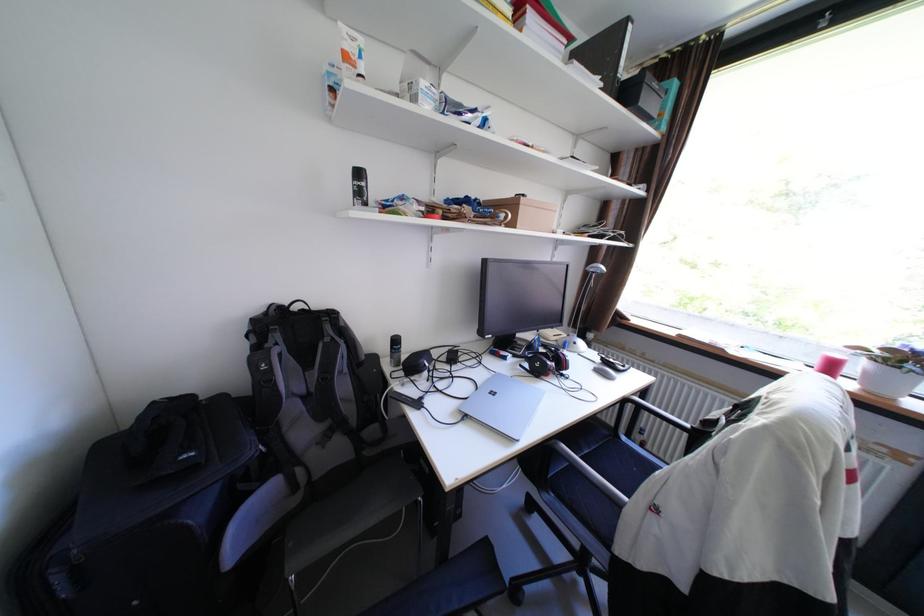
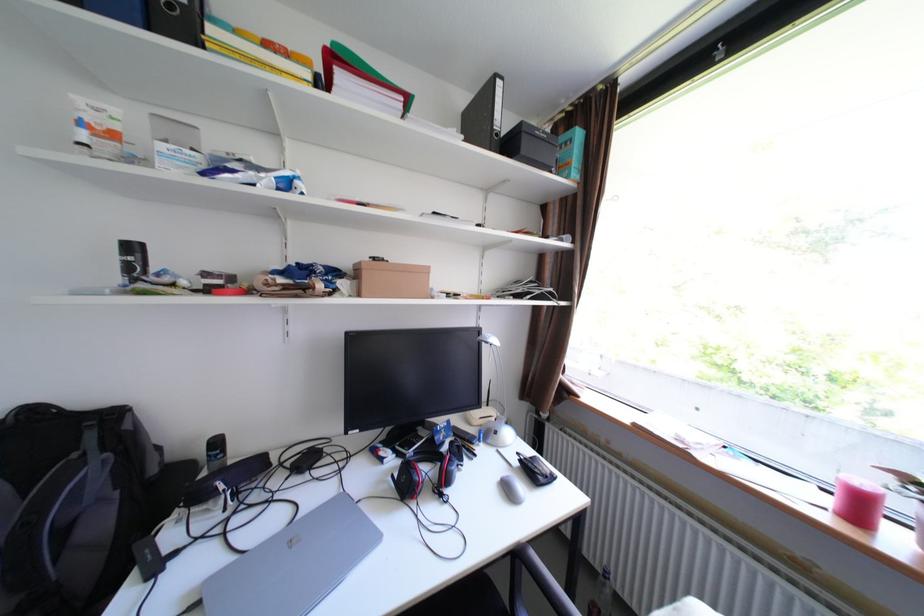
Find the pixel in the second image that matches (x=370, y=175) in the first image.

(143, 248)